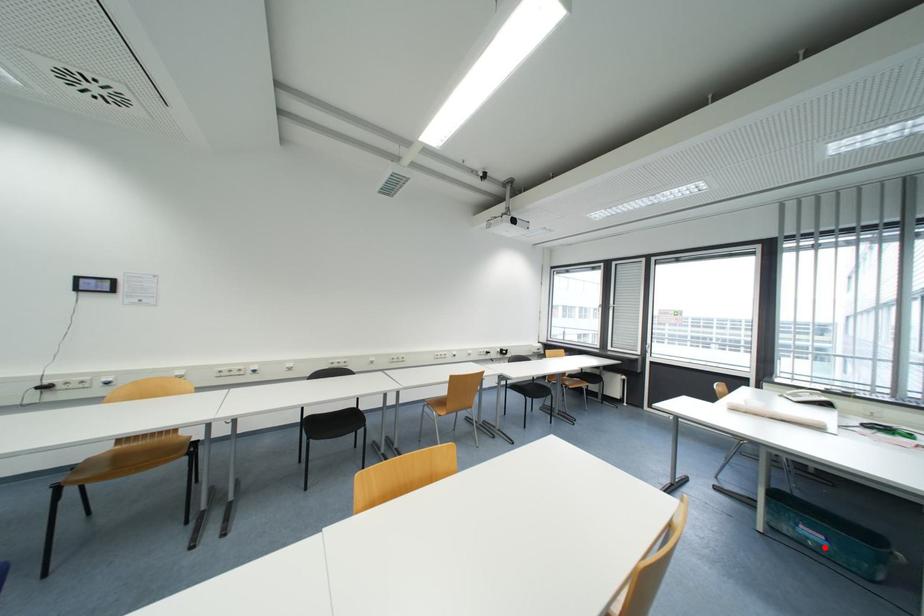
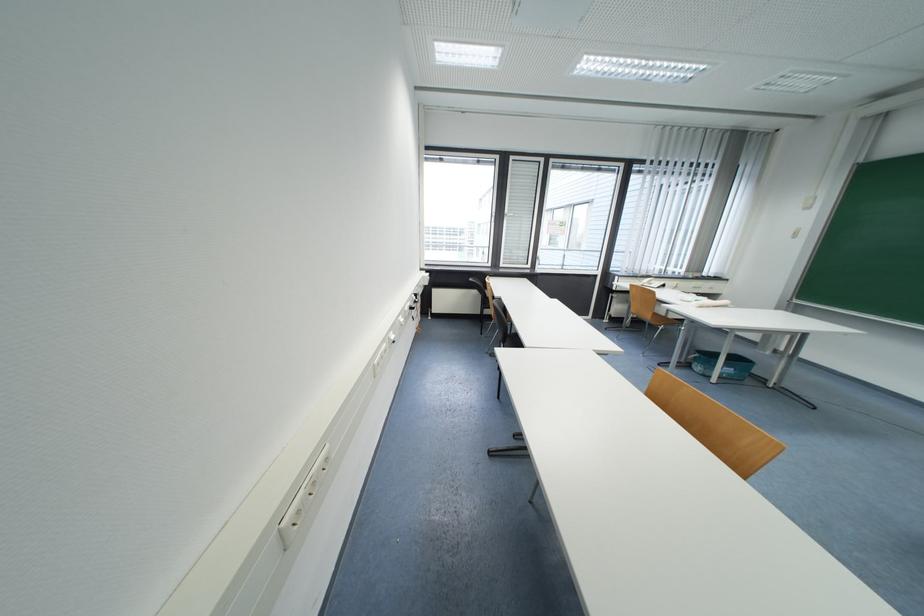
Where in the second image is the point corresponding to the highlighted location from the first image?

(734, 377)